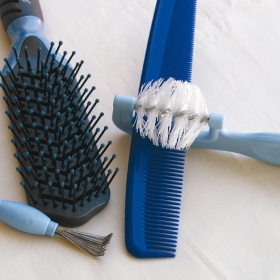
The image size is (280, 280). In order to click on brush with white bristles in this screenshot , I will do `click(181, 100)`.